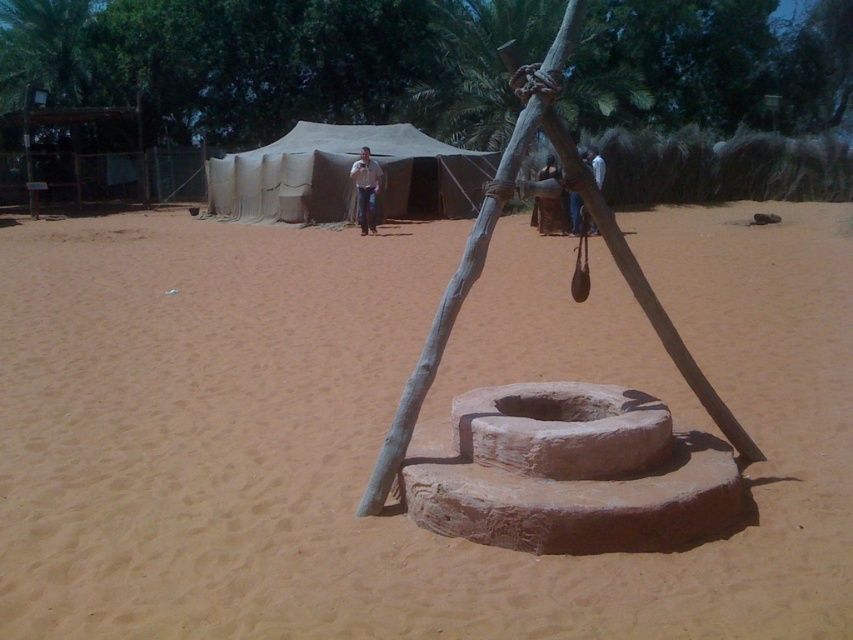
You are a traveler in the desert and you see a white shirt at center and a brown leather bag at center. Which item is wider?

The white shirt at center is wider than the brown leather bag at center.

You are a traveler in the desert and see a white shirt at center and a brown leather bag at center. Which item is closer to you?

The white shirt at center is closer to you because the brown leather bag at center is behind it.

You are setting up a camping gear and need to decide where to place your tent. You see the brown sandy dirt at center and the beige canvas tent at center. Which area has more space for placing the tent?

The beige canvas tent at center has more space because the brown sandy dirt at center is smaller than beige canvas tent at center.